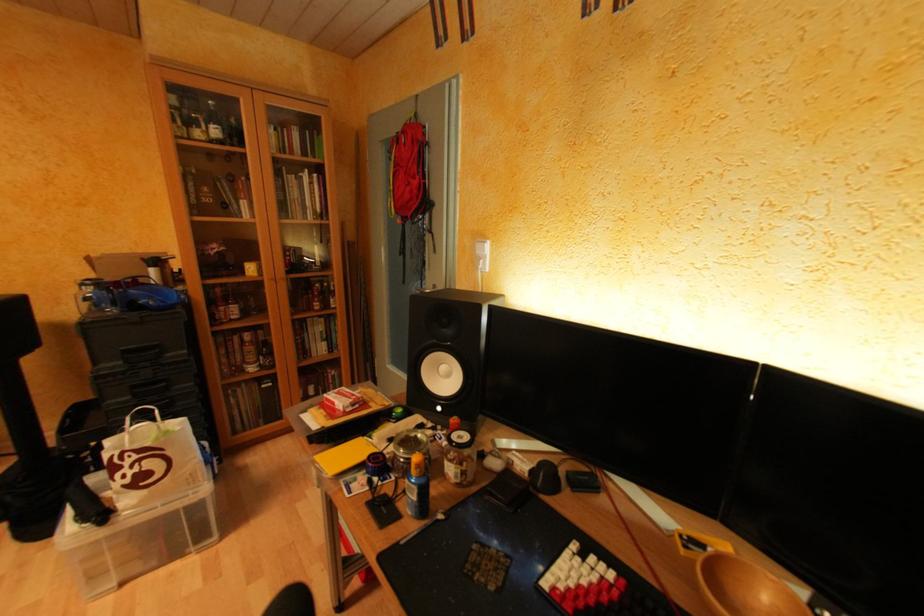
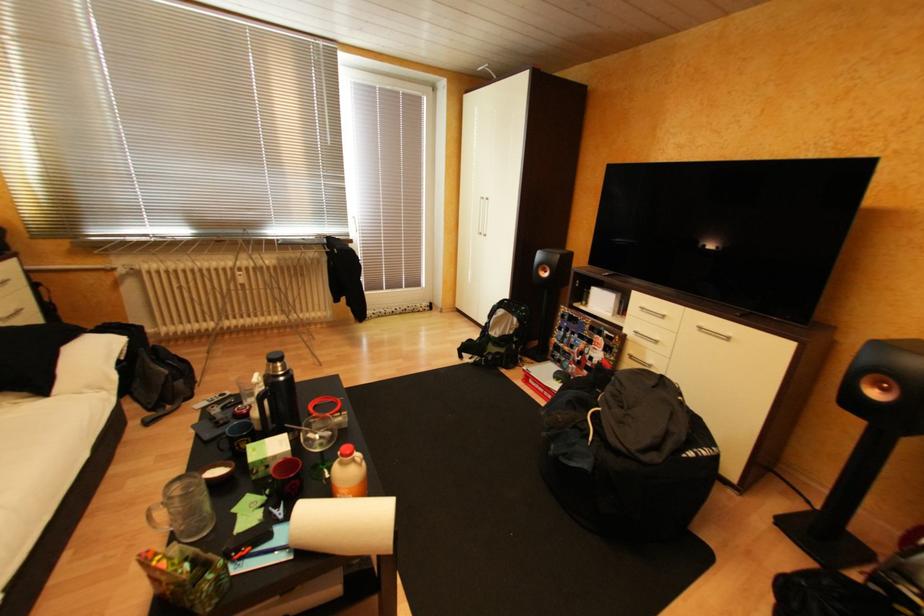
Consider the image. Based on the continuous images, in which direction is the camera rotating?

The camera's rotation is toward left-down.